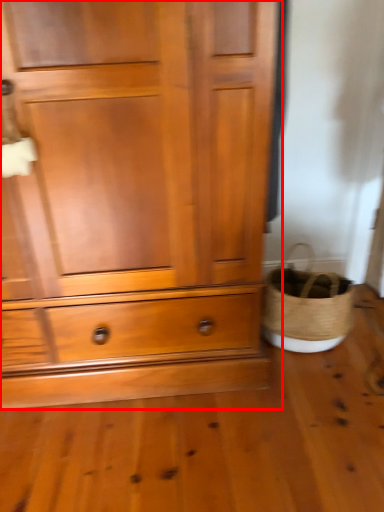
Question: In this image, where is chest of drawers (annotated by the red box) located relative to basket?

Choices:
 (A) left
 (B) right

Answer: (A)